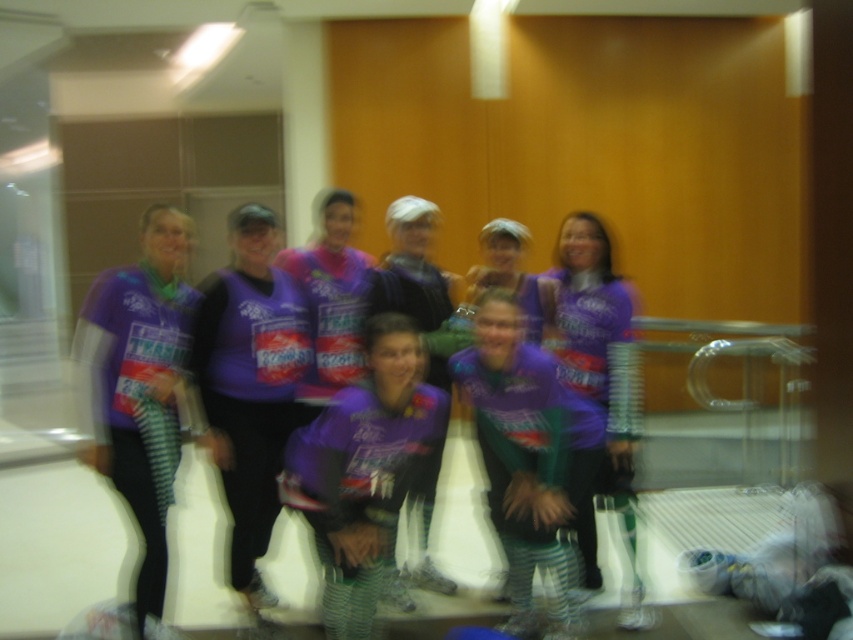
Can you confirm if purple fabric shirt at center is shorter than matte purple shirt at left?

No.

Based on the photo, which is more to the left, purple fabric shirt at center or matte purple shirt at left?

Positioned to the left is matte purple shirt at left.

Which is behind, point (285, 392) or point (167, 278)?

The point (285, 392) is more distant.

You are a GUI agent. You are given a task and a screenshot of the screen. Output one action in this format:
    pyautogui.click(x=<x>, y=<y>)
    Task: Click on the purple fabric shirt at center
    The height and width of the screenshot is (640, 853).
    Given the screenshot: What is the action you would take?
    pyautogui.click(x=248, y=385)

Can you confirm if matte purple shirt at left is taller than purple jersey at center?

In fact, matte purple shirt at left may be shorter than purple jersey at center.

Is matte purple shirt at left shorter than purple jersey at center?

Yes.

Where is `matte purple shirt at left`? The height and width of the screenshot is (640, 853). matte purple shirt at left is located at coordinates (138, 385).

Which is in front, point (247, 486) or point (619, 406)?

Point (247, 486)

Is purple fabric shirt at center wider than purple jersey at center?

No.

Locate an element on the screen. purple fabric shirt at center is located at coordinates (248, 385).